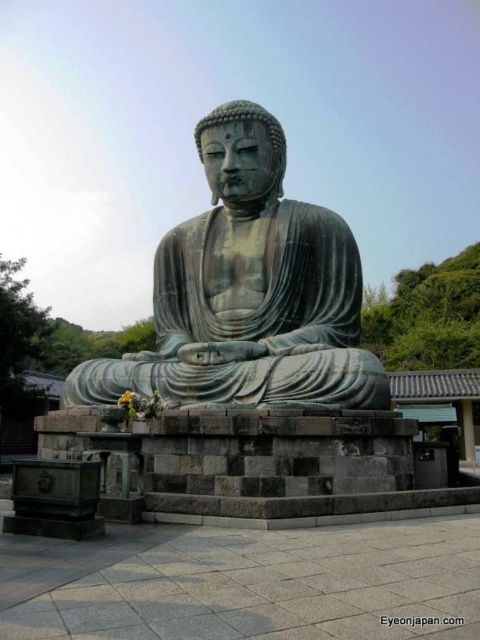
Is green patina stone statue at center below matte bronze statue at center?

No.

What do you see at coordinates (249, 291) in the screenshot? The image size is (480, 640). I see `green patina stone statue at center` at bounding box center [249, 291].

Locate an element on the screen. The width and height of the screenshot is (480, 640). green patina stone statue at center is located at coordinates (249, 291).